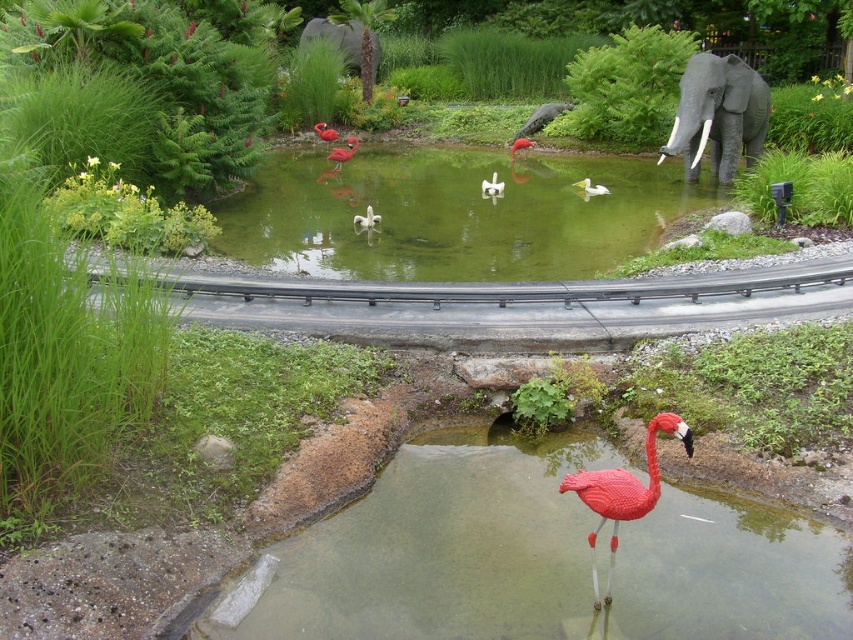
Does matte plastic flamingo at lower center have a greater height compared to matte pink flamingo at center?

Yes.

Can you confirm if matte plastic flamingo at lower center is positioned above matte pink flamingo at center?

No, matte plastic flamingo at lower center is not above matte pink flamingo at center.

Is point (631, 508) less distant than point (334, 129)?

Yes, point (631, 508) is in front of point (334, 129).

Find the location of a particular element. The image size is (853, 640). matte plastic flamingo at lower center is located at coordinates (624, 492).

Does point (608, 612) come farther from viewer compared to point (326, 132)?

That is False.

Find the location of `transparent plastic water at lower center`. transparent plastic water at lower center is located at coordinates (535, 557).

This screenshot has height=640, width=853. What do you see at coordinates (535, 557) in the screenshot?
I see `transparent plastic water at lower center` at bounding box center [535, 557].

Where is `transparent plastic water at lower center`? transparent plastic water at lower center is located at coordinates (535, 557).

Can you confirm if matte plastic flamingo at lower center is positioned to the left of matte plastic flamingo at center?

Indeed, matte plastic flamingo at lower center is positioned on the left side of matte plastic flamingo at center.

At what (x,y) coordinates should I click in order to perform the action: click on matte plastic flamingo at lower center. Please return your answer as a coordinate pair (x, y). This screenshot has width=853, height=640. Looking at the image, I should click on (624, 492).

Between point (585, 490) and point (525, 138), which one is positioned behind?

The point (525, 138) is behind.

The image size is (853, 640). Identify the location of matte plastic flamingo at lower center. (624, 492).